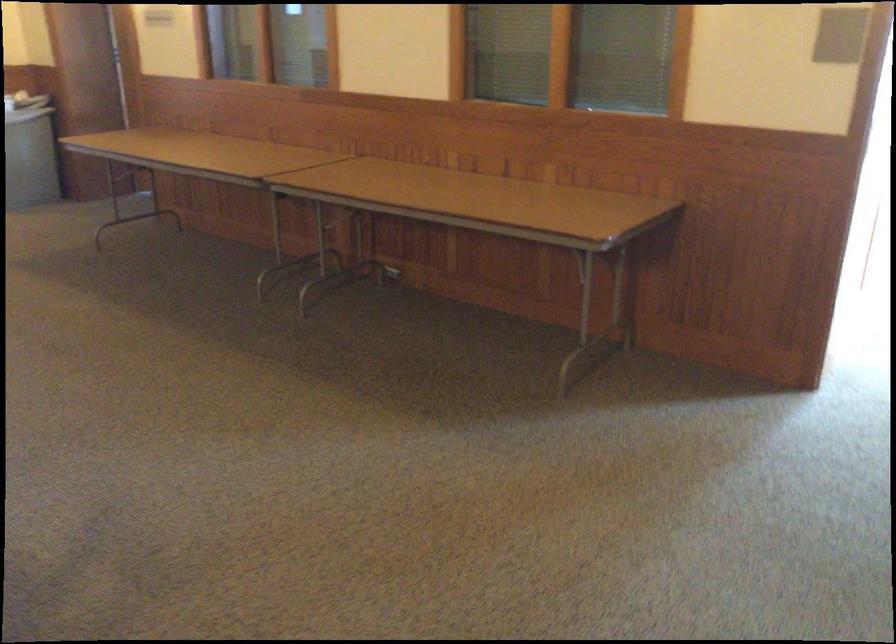
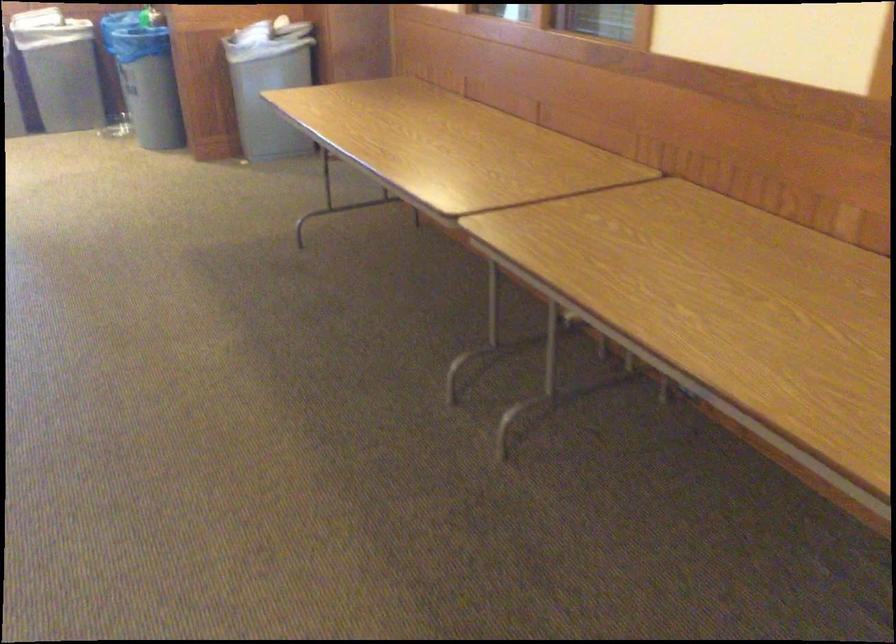
Question: What movement of the cameraman would produce the second image?

Choices:
 (A) Left
 (B) Right
 (C) Forward
 (D) Backward

Answer: (C)